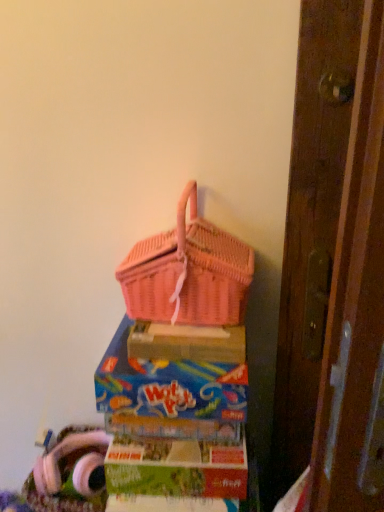
Question: From a real-world perspective, is matte cardboard box at lower center, which ranks as the 2th box in top-to-bottom order, above or below pink wicker picnic basket at upper center?

Choices:
 (A) below
 (B) above

Answer: (A)

Question: Considering the positions of matte cardboard box at lower center, which ranks as the 2th box in top-to-bottom order, and pink wicker picnic basket at upper center in the image, is matte cardboard box at lower center, which ranks as the 2th box in top-to-bottom order, taller or shorter than pink wicker picnic basket at upper center?

Choices:
 (A) short
 (B) tall

Answer: (A)

Question: Based on their relative distances, which object is nearer to the matte cardboard box at lower center, which ranks as the 2th box in top-to-bottom order?

Choices:
 (A) pink wicker picnic basket at upper center
 (B) pink wicker basket at upper center, placed as the first box when sorted from top to bottom
 (C) cardboard box at upper right

Answer: (B)

Question: Which object is the closest to the pink wicker picnic basket at upper center?

Choices:
 (A) pink wicker basket at upper center, the second box from the bottom
 (B) matte cardboard box at lower center, which ranks as the 1th box in bottom-to-top order
 (C) cardboard box at upper right

Answer: (C)